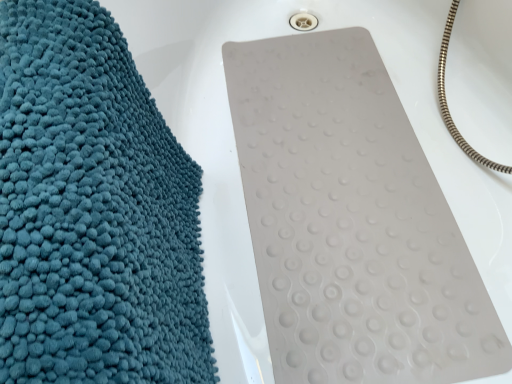
Question: Considering the relative sizes of white rubber mat at center and teal fluffy towel at left in the image provided, is white rubber mat at center thinner than teal fluffy towel at left?

Choices:
 (A) yes
 (B) no

Answer: (B)

Question: From the image's perspective, is white rubber mat at center below teal fluffy towel at left?

Choices:
 (A) no
 (B) yes

Answer: (A)

Question: Does white rubber mat at center have a greater height compared to teal fluffy towel at left?

Choices:
 (A) yes
 (B) no

Answer: (B)

Question: Are white rubber mat at center and teal fluffy towel at left making contact?

Choices:
 (A) no
 (B) yes

Answer: (A)

Question: Does white rubber mat at center lie behind teal fluffy towel at left?

Choices:
 (A) yes
 (B) no

Answer: (A)

Question: Is white rubber mat at center surrounding teal fluffy towel at left?

Choices:
 (A) no
 (B) yes

Answer: (A)

Question: From a real-world perspective, is teal fluffy towel at left under white rubber mat at center?

Choices:
 (A) no
 (B) yes

Answer: (A)

Question: Is teal fluffy towel at left facing towards white rubber mat at center?

Choices:
 (A) yes
 (B) no

Answer: (B)

Question: Is teal fluffy towel at left wider than white rubber mat at center?

Choices:
 (A) yes
 (B) no

Answer: (B)

Question: From the image's perspective, is teal fluffy towel at left below white rubber mat at center?

Choices:
 (A) yes
 (B) no

Answer: (A)

Question: Is teal fluffy towel at left not inside white rubber mat at center?

Choices:
 (A) yes
 (B) no

Answer: (A)

Question: Does teal fluffy towel at left have a lesser height compared to white rubber mat at center?

Choices:
 (A) yes
 (B) no

Answer: (B)

Question: Visually, is teal fluffy towel at left positioned to the left or to the right of white rubber mat at center?

Choices:
 (A) left
 (B) right

Answer: (A)